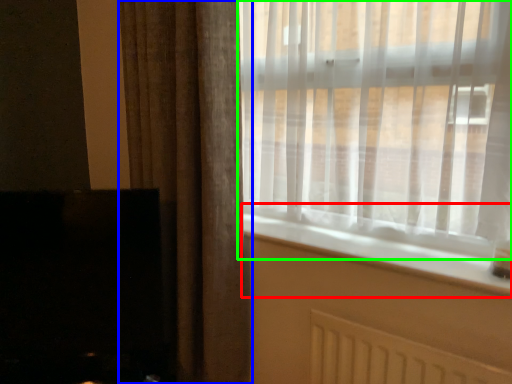
Question: Based on their relative distances, which object is farther from window sill (highlighted by a red box)? Choose from curtain (highlighted by a blue box) and window (highlighted by a green box).

Choices:
 (A) curtain
 (B) window

Answer: (A)